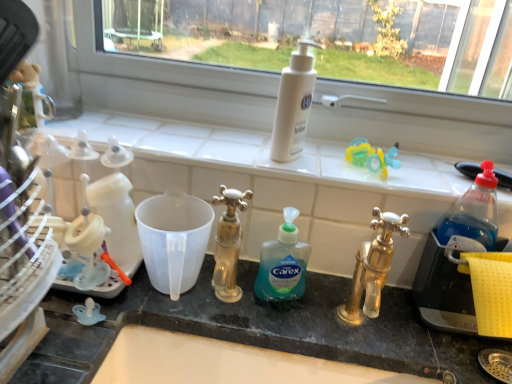
Question: Which direction should I rotate to look at white matte lotion at upper center, which is the second cleaning product in bottom-to-top order, — up or down?

Choices:
 (A) up
 (B) down

Answer: (A)

Question: Does green translucent liquid soap at center, the second cleaning product viewed from the top, have a greater width compared to white matte lotion at upper center, the first cleaning product from the top?

Choices:
 (A) no
 (B) yes

Answer: (A)

Question: Is green translucent liquid soap at center, the 1th cleaning product from the bottom, not close to white matte lotion at upper center, which is the second cleaning product in bottom-to-top order?

Choices:
 (A) no
 (B) yes

Answer: (A)

Question: Is green translucent liquid soap at center, the 1th cleaning product from the bottom, surrounding white matte lotion at upper center, which is the second cleaning product in bottom-to-top order?

Choices:
 (A) yes
 (B) no

Answer: (B)

Question: Does green translucent liquid soap at center, the 1th cleaning product from the bottom, come behind white matte lotion at upper center, the first cleaning product from the top?

Choices:
 (A) yes
 (B) no

Answer: (B)

Question: Does green translucent liquid soap at center, the 1th cleaning product from the bottom, have a larger size compared to white matte lotion at upper center, which is the second cleaning product in bottom-to-top order?

Choices:
 (A) yes
 (B) no

Answer: (B)

Question: Considering the relative sizes of green translucent liquid soap at center, the second cleaning product viewed from the top, and white matte lotion at upper center, which is the second cleaning product in bottom-to-top order, in the image provided, is green translucent liquid soap at center, the second cleaning product viewed from the top, taller than white matte lotion at upper center, which is the second cleaning product in bottom-to-top order,?

Choices:
 (A) no
 (B) yes

Answer: (A)

Question: Is white matte lotion at upper center, which is the second cleaning product in bottom-to-top order, touching green translucent liquid soap at center, the second cleaning product viewed from the top?

Choices:
 (A) yes
 (B) no

Answer: (B)

Question: Can you confirm if white matte lotion at upper center, which is the second cleaning product in bottom-to-top order, is positioned to the right of green translucent liquid soap at center, the 1th cleaning product from the bottom?

Choices:
 (A) no
 (B) yes

Answer: (B)

Question: Is green translucent liquid soap at center, the second cleaning product viewed from the top, completely or partially inside white matte lotion at upper center, the first cleaning product from the top?

Choices:
 (A) no
 (B) yes

Answer: (A)

Question: Is white matte lotion at upper center, which is the second cleaning product in bottom-to-top order, not inside green translucent liquid soap at center, the second cleaning product viewed from the top?

Choices:
 (A) yes
 (B) no

Answer: (A)

Question: Considering the relative sizes of white matte lotion at upper center, the first cleaning product from the top, and green translucent liquid soap at center, the second cleaning product viewed from the top, in the image provided, is white matte lotion at upper center, the first cleaning product from the top, shorter than green translucent liquid soap at center, the second cleaning product viewed from the top,?

Choices:
 (A) no
 (B) yes

Answer: (A)

Question: Is the position of white matte lotion at upper center, the first cleaning product from the top, less distant than that of green translucent liquid soap at center, the second cleaning product viewed from the top?

Choices:
 (A) no
 (B) yes

Answer: (A)

Question: From the image's perspective, is white matte lotion at upper center, the first cleaning product from the top, above or below green translucent liquid soap at center, the second cleaning product viewed from the top?

Choices:
 (A) below
 (B) above

Answer: (B)